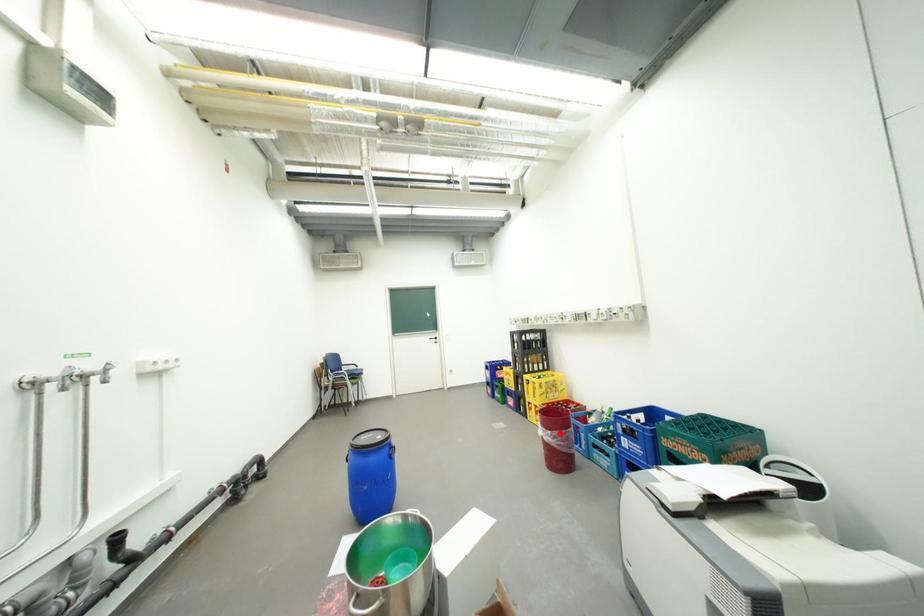
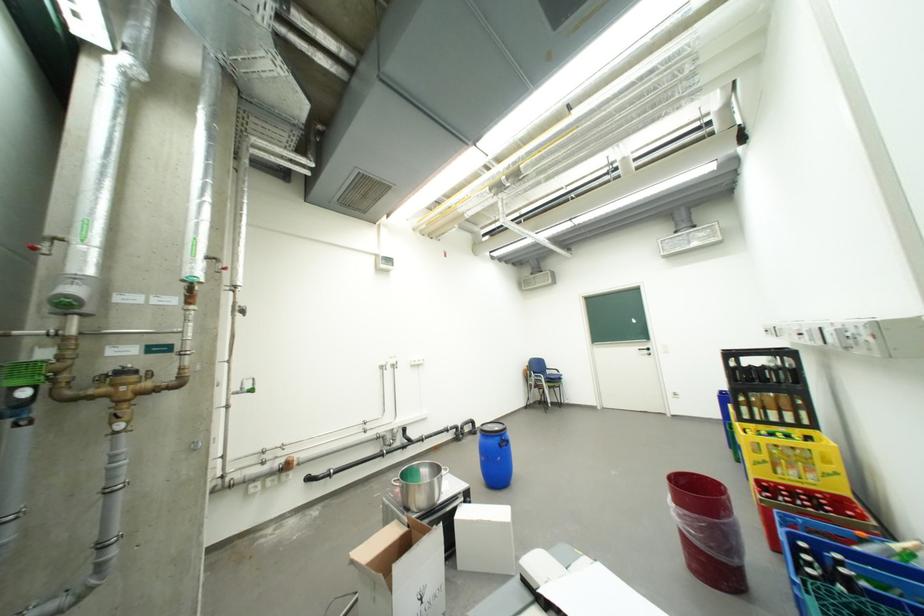
In the second image, find the point that corresponds to the highlighted location in the first image.

(685, 507)